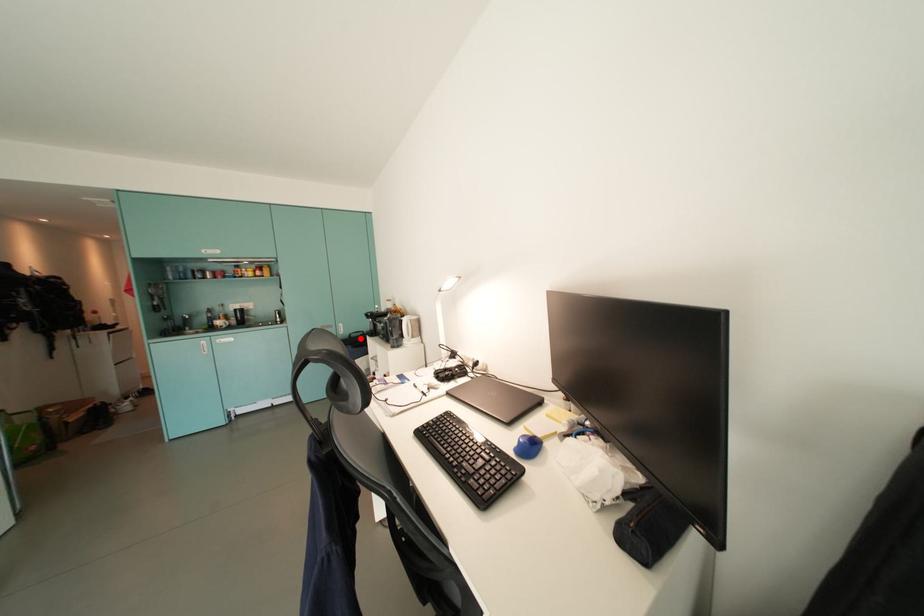
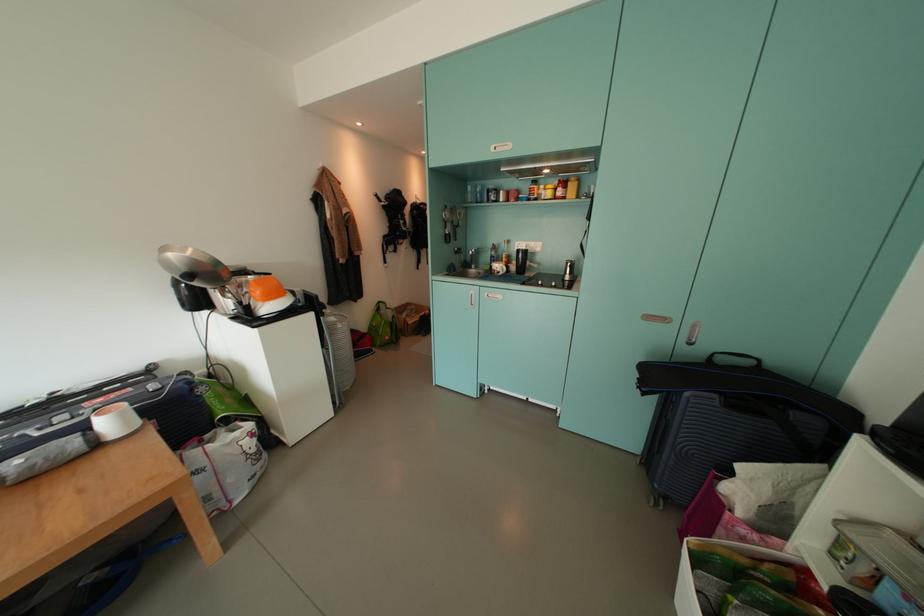
The point at the highlighted location is marked in the first image. Where is the corresponding point in the second image?

(730, 363)